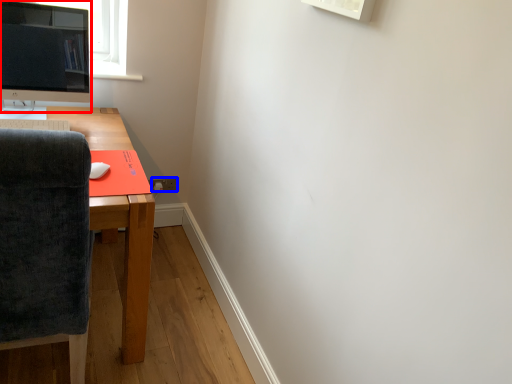
Question: Which object is closer to the camera taking this photo, computer monitor (highlighted by a red box) or power outlet (highlighted by a blue box)?

Choices:
 (A) computer monitor
 (B) power outlet

Answer: (A)